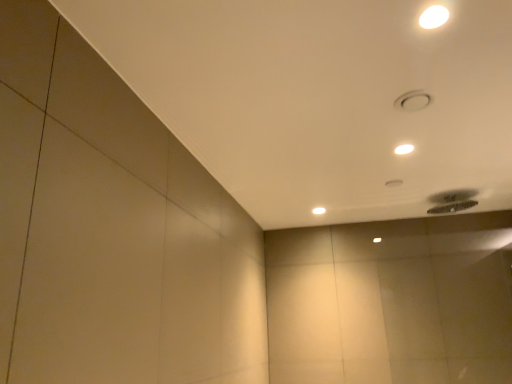
Question: Choose the correct answer: Is white glossy lamp at upper center, the 1th lamp positioned from the left, inside white glossy lamp at upper right, the 3th lamp positioned from the left, or outside it?

Choices:
 (A) outside
 (B) inside

Answer: (A)

Question: Is white glossy lamp at upper center, the third lamp in the front-to-back sequence, taller or shorter than white glossy lamp at upper right, the second lamp from the top?

Choices:
 (A) short
 (B) tall

Answer: (B)

Question: Estimate the real-world distances between objects in this image. Which object is closer to the white glossy lamp at upper right, which appears as the 2th lamp when ordered from the bottom?

Choices:
 (A) white glossy lamp at upper right, the 1th lamp positioned from the front
 (B) white glossy lamp at upper center, acting as the 1th lamp starting from the back

Answer: (A)

Question: Estimate the real-world distances between objects in this image. Which object is closer to the white glossy lamp at upper right, the 3th lamp positioned from the left?

Choices:
 (A) white glossy lamp at upper center, the third lamp positioned from the right
 (B) white glossy lamp at upper right, marked as the third lamp in a back-to-front arrangement

Answer: (B)